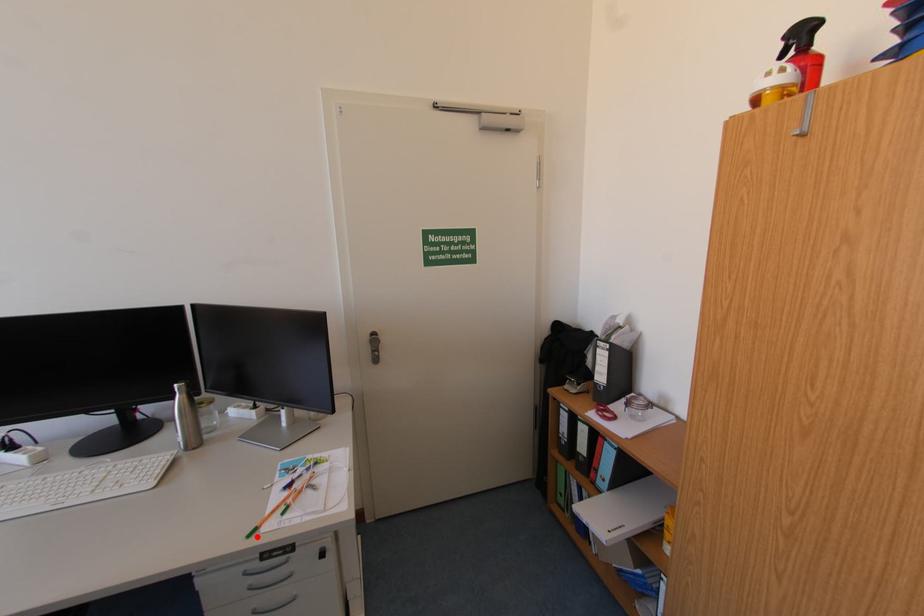
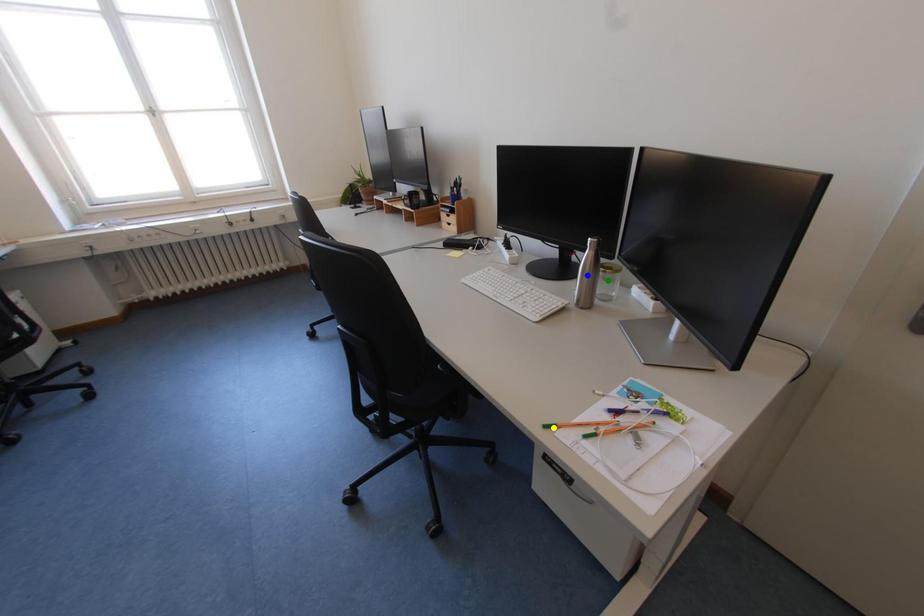
Question: I am providing you with two images of the same scene from different viewpoints. A red point is marked on the first image. You are given multiple points on the second image. Can you choose the point in image 2 that corresponds to the point in image 1?

Choices:
 (A) green point
 (B) yellow point
 (C) blue point

Answer: (B)